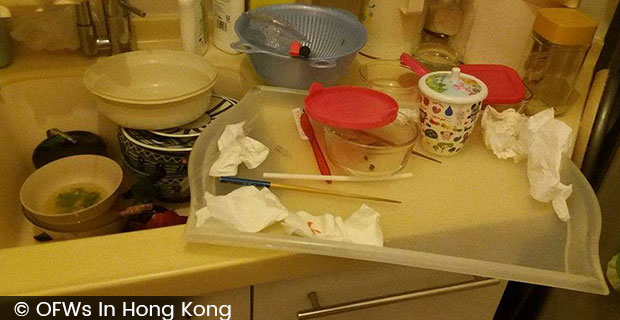
Image resolution: width=620 pixels, height=320 pixels. In order to click on bottles of dish soap in this screenshot , I will do `click(221, 14)`, `click(196, 24)`.